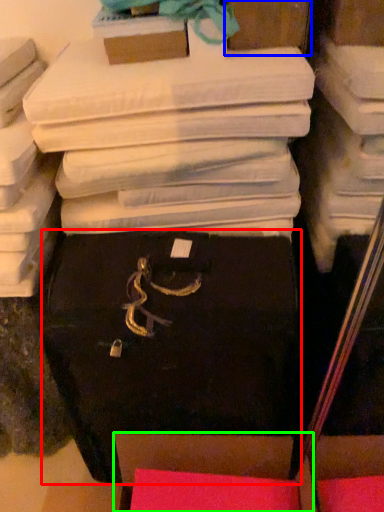
Question: Based on their relative distances, which object is farther from storage box (highlighted by a red box)? Choose from storage box (highlighted by a blue box) and storage box (highlighted by a green box).

Choices:
 (A) storage box
 (B) storage box

Answer: (A)